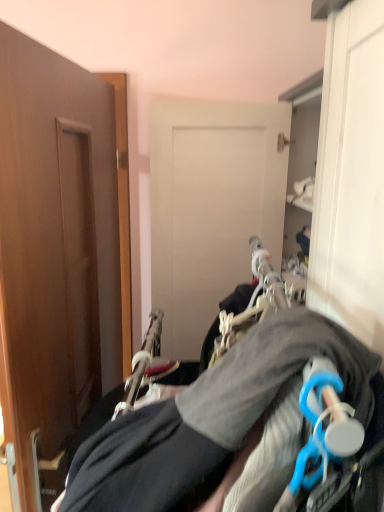
Identify the location of brown wood door at left. The image size is (384, 512). (56, 244).

The height and width of the screenshot is (512, 384). What do you see at coordinates (56, 244) in the screenshot?
I see `brown wood door at left` at bounding box center [56, 244].

The height and width of the screenshot is (512, 384). What do you see at coordinates (210, 416) in the screenshot?
I see `gray fabric hanger at center` at bounding box center [210, 416].

What is the approximate width of gray fabric hanger at center?

23.54 inches.

I want to click on gray fabric hanger at center, so click(x=210, y=416).

You are a GUI agent. You are given a task and a screenshot of the screen. Output one action in this format:
    pyautogui.click(x=<x>, y=<y>)
    Task: Click on the brown wood door at left
    This screenshot has width=384, height=512.
    Given the screenshot: What is the action you would take?
    pyautogui.click(x=56, y=244)

Between brown wood door at left and gray fabric hanger at center, which one appears on the left side from the viewer's perspective?

Positioned to the left is brown wood door at left.

Who is more distant, brown wood door at left or gray fabric hanger at center?

brown wood door at left is behind.

Is point (79, 163) positioned before point (233, 431)?

No, (79, 163) is further to viewer.

From the image's perspective, which object appears higher, brown wood door at left or gray fabric hanger at center?

From the image's view, brown wood door at left is above.

From a real-world perspective, is brown wood door at left located higher than gray fabric hanger at center?

Yes, from a real-world perspective, brown wood door at left is above gray fabric hanger at center.

Considering the relative sizes of brown wood door at left and gray fabric hanger at center in the image provided, is brown wood door at left thinner than gray fabric hanger at center?

Yes, brown wood door at left is thinner than gray fabric hanger at center.

Is brown wood door at left shorter than gray fabric hanger at center?

Incorrect, the height of brown wood door at left does not fall short of that of gray fabric hanger at center.

Between brown wood door at left and gray fabric hanger at center, which one has smaller size?

With smaller size is brown wood door at left.

Is brown wood door at left spatially inside gray fabric hanger at center, or outside of it?

brown wood door at left lies outside gray fabric hanger at center.

Are brown wood door at left and gray fabric hanger at center making contact?

brown wood door at left and gray fabric hanger at center are clearly separated.

Based on the photo, is brown wood door at left oriented away from gray fabric hanger at center?

Yes, brown wood door at left is facing away from gray fabric hanger at center.

Can you tell me how much brown wood door at left and gray fabric hanger at center differ in facing direction?

1.4 degrees.

Image resolution: width=384 pixels, height=512 pixels. What are the coordinates of `couple located in front of the brown wood door at left` in the screenshot? It's located at (210, 416).

Considering the relative positions of gray fabric hanger at center and brown wood door at left in the image provided, is gray fabric hanger at center to the left or to the right of brown wood door at left?

From the image, it's evident that gray fabric hanger at center is to the right of brown wood door at left.

Based on the photo, is gray fabric hanger at center positioned in front of brown wood door at left?

Yes, gray fabric hanger at center is closer to the viewer.

Considering the positions of point (146, 504) and point (99, 302), is point (146, 504) closer or farther from the camera than point (99, 302)?

Point (146, 504) appears to be closer to the viewer than point (99, 302).

From the image's perspective, which object appears higher, gray fabric hanger at center or brown wood door at left?

brown wood door at left, from the image's perspective.

From a real-world perspective, who is located higher, gray fabric hanger at center or brown wood door at left?

In real-world perspective, brown wood door at left is above.

Is gray fabric hanger at center wider than brown wood door at left?

Yes, gray fabric hanger at center is wider than brown wood door at left.

Considering the sizes of objects gray fabric hanger at center and brown wood door at left in the image provided, who is taller, gray fabric hanger at center or brown wood door at left?

With more height is brown wood door at left.

Between gray fabric hanger at center and brown wood door at left, which one has larger size?

Bigger between the two is gray fabric hanger at center.

Could brown wood door at left be considered to be inside gray fabric hanger at center?

Definitely not — brown wood door at left is not inside gray fabric hanger at center.

Is gray fabric hanger at center with brown wood door at left?

No, gray fabric hanger at center is not next to brown wood door at left.

Could you tell me if gray fabric hanger at center is turned towards brown wood door at left?

Yes, gray fabric hanger at center faces towards brown wood door at left.

Measure the distance from gray fabric hanger at center to brown wood door at left.

gray fabric hanger at center and brown wood door at left are 19.98 inches apart from each other.

At what (x,y) coordinates should I click in order to perform the action: click on door that is on the left side of gray fabric hanger at center. Please return your answer as a coordinate pair (x, y). The width and height of the screenshot is (384, 512). Looking at the image, I should click on (56, 244).

The height and width of the screenshot is (512, 384). I want to click on couple on the right of brown wood door at left, so click(x=210, y=416).

The image size is (384, 512). What are the coordinates of `door lying above the gray fabric hanger at center (from the image's perspective)` in the screenshot? It's located at (56, 244).